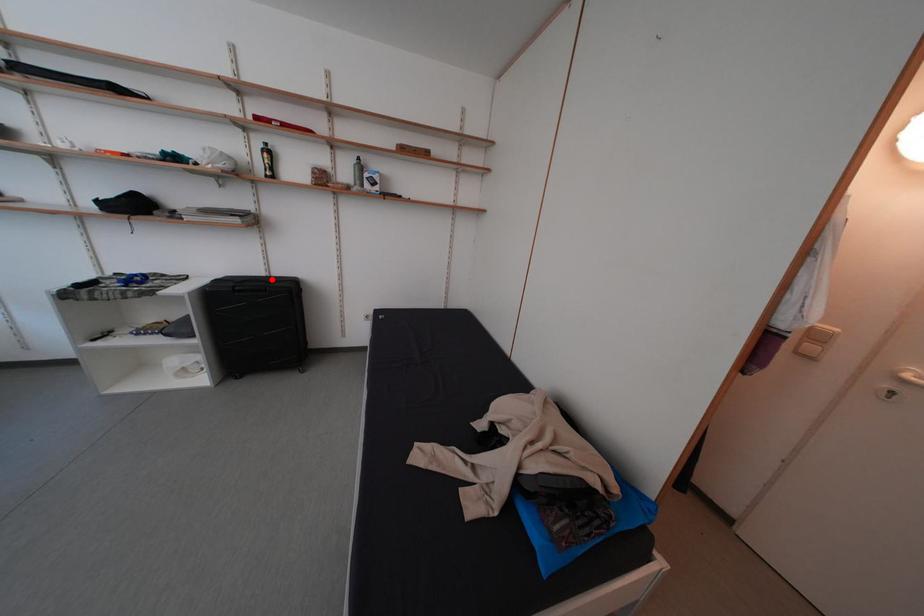
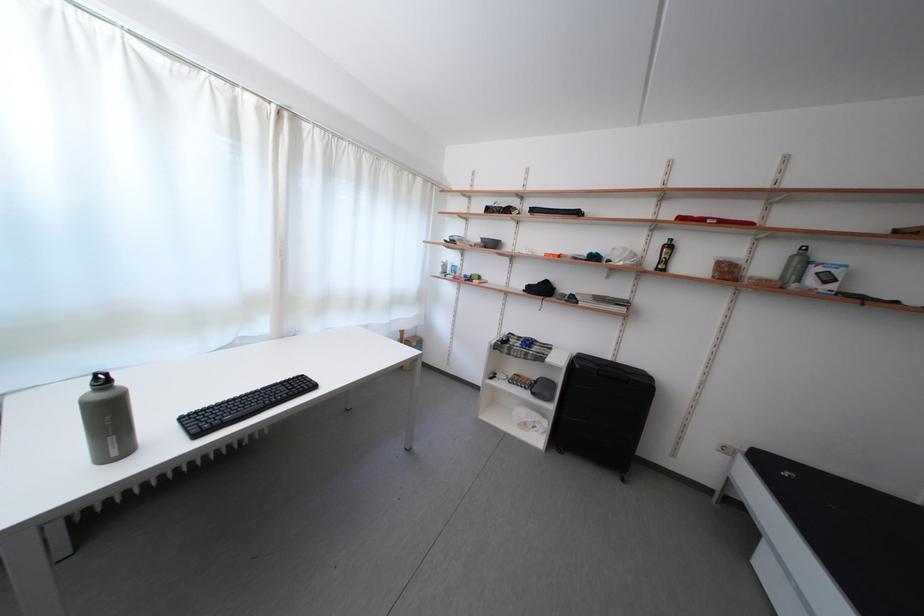
Where in the second image is the point corresponding to the highlighted location from the first image?

(617, 363)